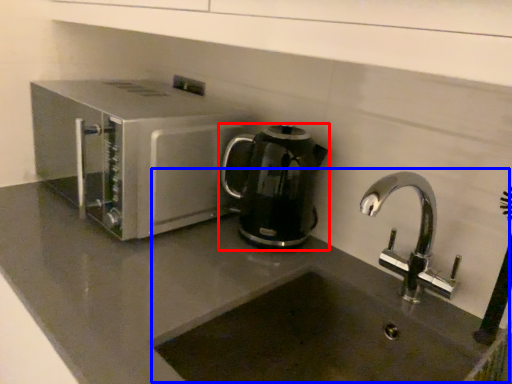
Question: Which object is further to the camera taking this photo, kitchen appliance (highlighted by a red box) or sink (highlighted by a blue box)?

Choices:
 (A) kitchen appliance
 (B) sink

Answer: (A)